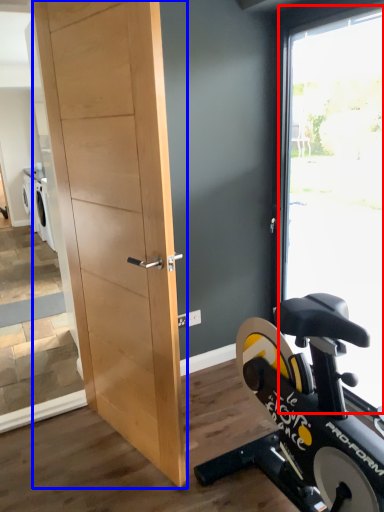
Question: Which object appears closest to the camera in this image, window (highlighted by a red box) or barn door (highlighted by a blue box)?

Choices:
 (A) window
 (B) barn door

Answer: (B)